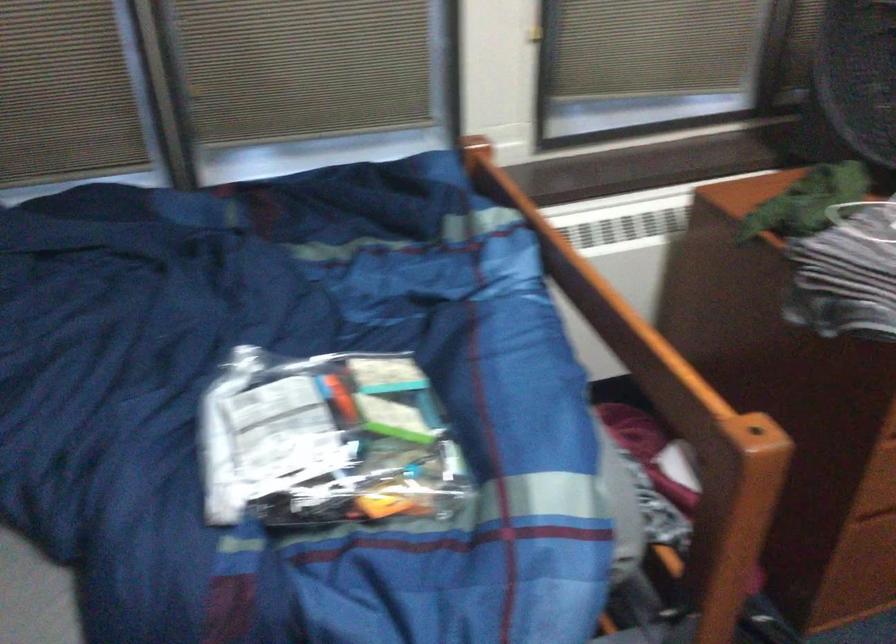
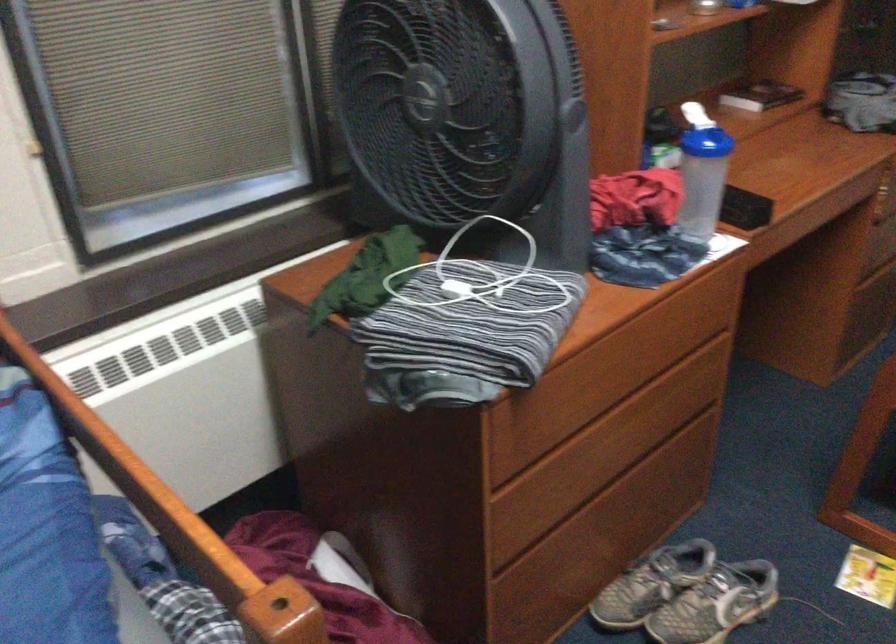
Question: The first image is from the beginning of the video and the second image is from the end. How did the camera likely rotate when shooting the video?

Choices:
 (A) Left
 (B) Right
 (C) Up
 (D) Down

Answer: (B)